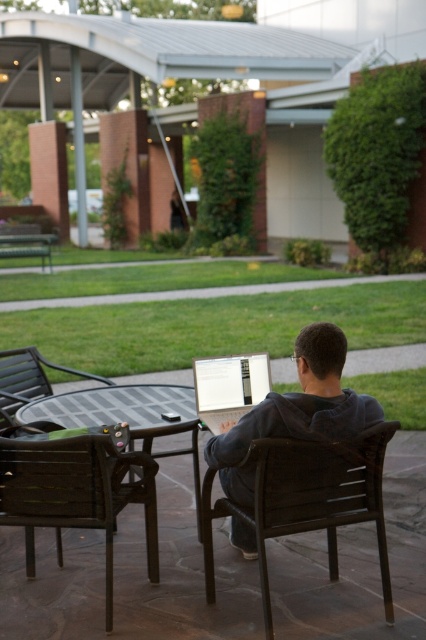
You are planning to place a new decorative item on the table between the brown wooden chair at lower left and the dark gray hoodie at center. Considering their sizes, which object should you avoid placing the item closer to?

The brown wooden chair at lower left is bigger than the dark gray hoodie at center, so you should avoid placing the item closer to the brown wooden chair at lower left to ensure there is enough space.

You are organizing a small event and need to place a rectangular box that measures 0.5 meters in width on the table. Considering the silver metallic laptop at center and the dark brown plastic chair at center, which object should the box be placed near to ensure it fits without overlapping?

The silver metallic laptop at center occupies less space than the dark brown plastic chair at center, so the box should be placed near the silver metallic laptop at center to ensure it fits without overlapping.

You are a delivery person who needs to place a small package between the brown wooden chair at lower left and the dark gray hoodie at center. Can you fit the package in the space between them if the package is 24 inches long?

The brown wooden chair at lower left is 25.73 inches from dark gray hoodie at center. Since the package is 24 inches long, it can fit in the space between them as the distance is slightly larger than the package length.